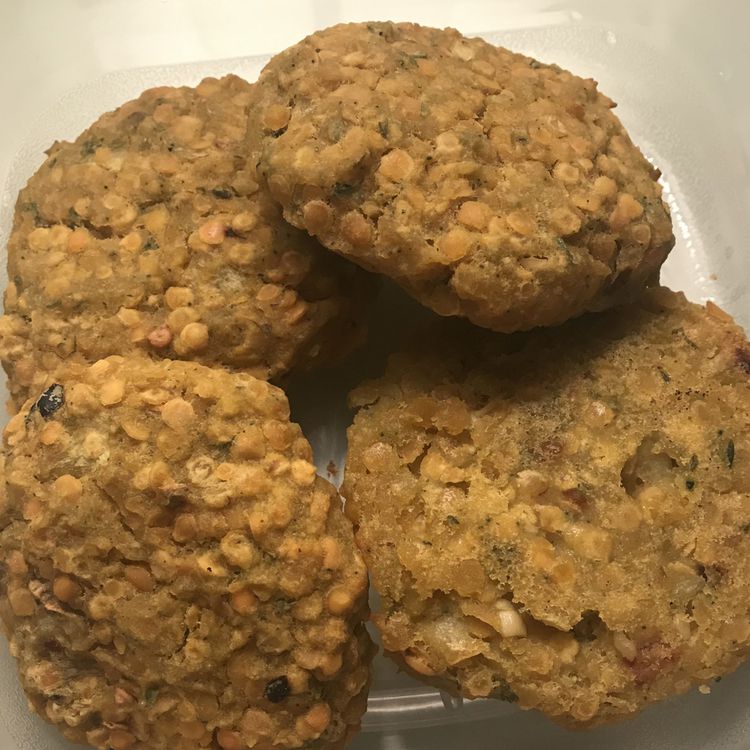
The height and width of the screenshot is (750, 750). What are the coordinates of `plate` in the screenshot? It's located at (411, 706).